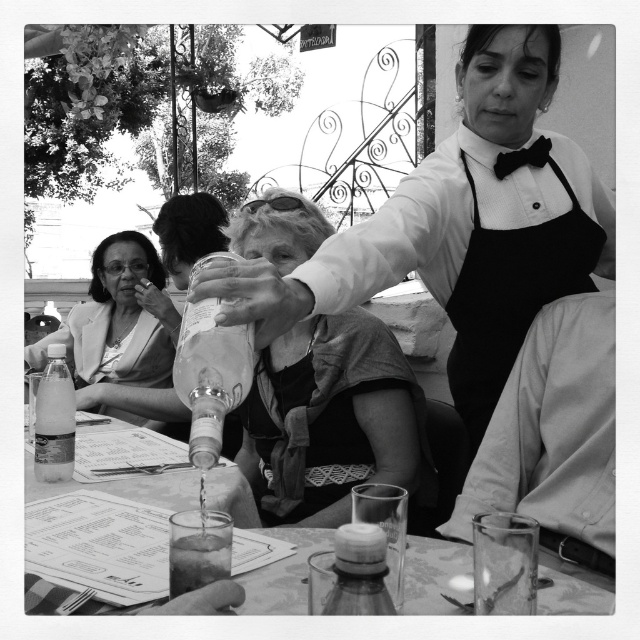
Who is positioned more to the left, clear glass at lower center or translucent glass at table center?

clear glass at lower center

Looking at this image, who is more distant from viewer, (35, 486) or (200, 532)?

The point (35, 486) is behind.

Does point (419, 580) come closer to viewer compared to point (177, 525)?

No.

This screenshot has width=640, height=640. Find the location of `clear glass at lower center`. clear glass at lower center is located at coordinates (282, 576).

Between translucent plastic bottle at center and translucent glass at table center, which one appears on the left side from the viewer's perspective?

From the viewer's perspective, translucent glass at table center appears more on the left side.

Is point (346, 577) in front of point (202, 582)?

Yes.

At what (x,y) coordinates should I click in order to perform the action: click on translucent plastic bottle at center. Please return your answer as a coordinate pair (x, y). Looking at the image, I should click on (358, 572).

I want to click on translucent plastic bottle at center, so click(358, 572).

Is matte glass bottle at center bigger than translucent glass at table center?

Correct, matte glass bottle at center is larger in size than translucent glass at table center.

Does matte glass bottle at center have a smaller size compared to translucent glass at table center?

No.

Where is `matte glass bottle at center`? matte glass bottle at center is located at coordinates (332, 420).